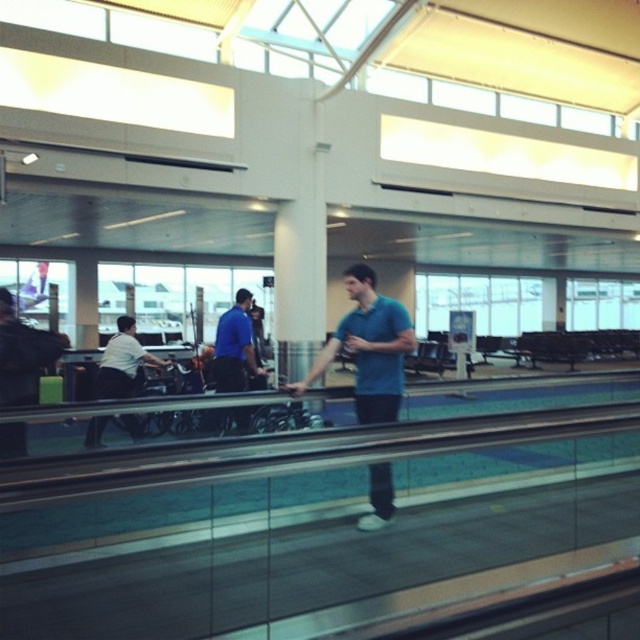
Question: Does blue smooth shirt at center have a larger size compared to white shirt at left?

Choices:
 (A) no
 (B) yes

Answer: (A)

Question: Based on their relative distances, which object is farther from the white shirt at left?

Choices:
 (A) blue smooth shirt at center
 (B) blue matte shirt at center

Answer: (B)

Question: Which point appears closest to the camera in this image?

Choices:
 (A) (157, 356)
 (B) (243, 308)
 (C) (381, 387)

Answer: (C)

Question: Is blue matte shirt at center further to the viewer compared to blue smooth shirt at center?

Choices:
 (A) no
 (B) yes

Answer: (A)

Question: Among these objects, which one is farthest from the camera?

Choices:
 (A) blue matte shirt at center
 (B) blue smooth shirt at center

Answer: (B)

Question: Does blue smooth shirt at center come in front of white shirt at left?

Choices:
 (A) yes
 (B) no

Answer: (A)